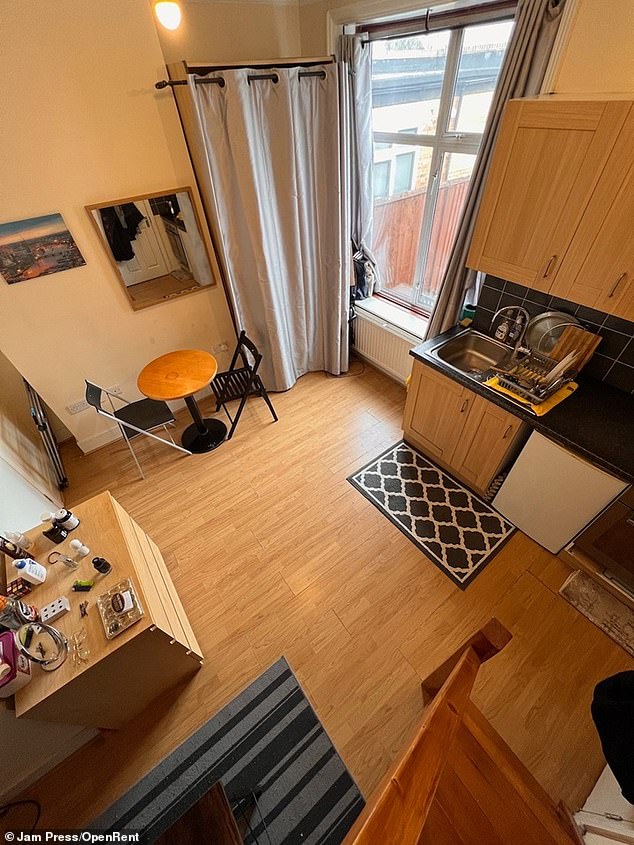
The width and height of the screenshot is (634, 845). Find the location of `window`. window is located at coordinates (425, 159).